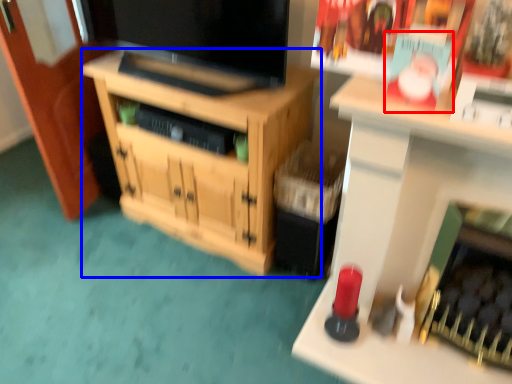
Question: Which object is closer to the camera taking this photo, magazine (highlighted by a red box) or cabinetry (highlighted by a blue box)?

Choices:
 (A) magazine
 (B) cabinetry

Answer: (A)